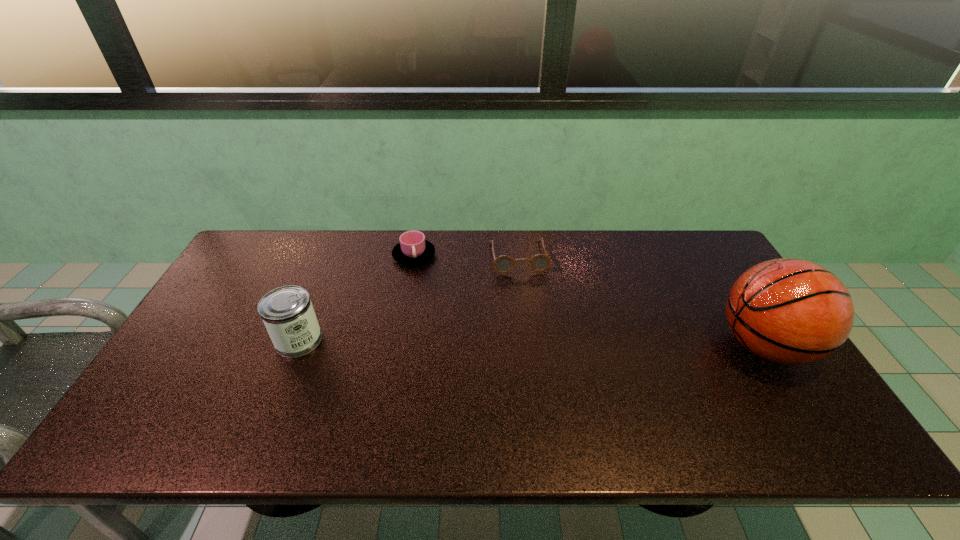
The image size is (960, 540). Identify the location of unoccupied area between the cup and the second tallest object. [356, 298].

The width and height of the screenshot is (960, 540). Identify the location of free area in between the second tallest object and the rightmost object. (532, 343).

Where is `free spot between the rightmost object and the cup`? This screenshot has width=960, height=540. free spot between the rightmost object and the cup is located at coordinates (589, 300).

I want to click on free point between the leftmost object and the cup, so click(356, 298).

Image resolution: width=960 pixels, height=540 pixels. Identify the location of empty space between the spectacles and the second tallest object. (408, 299).

Locate an element on the screen. Image resolution: width=960 pixels, height=540 pixels. empty location between the second tallest object and the tallest object is located at coordinates coord(532,343).

Locate which object is the third closest to the second object from left to right. Please provide its 2D coordinates. Your answer should be formatted as a tuple, i.e. [(x, y)], where the tuple contains the x and y coordinates of a point satisfying the conditions above.

[(789, 311)]

Identify which object is the second nearest to the leftmost object. Please provide its 2D coordinates. Your answer should be formatted as a tuple, i.e. [(x, y)], where the tuple contains the x and y coordinates of a point satisfying the conditions above.

[(503, 264)]

Find the location of a particular element. The height and width of the screenshot is (540, 960). vacant space that satisfies the following two spatial constraints: 1. on the back side of the can; 2. on the right side of the cup is located at coordinates (333, 255).

What are the coordinates of `blank area in the image that satisfies the following two spatial constraints: 1. on the front side of the cup; 2. on the side with spill of the basketball` in the screenshot? It's located at (397, 346).